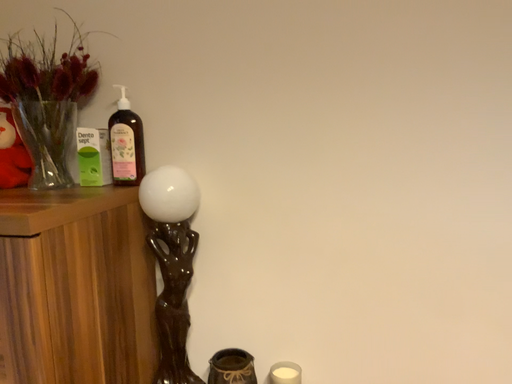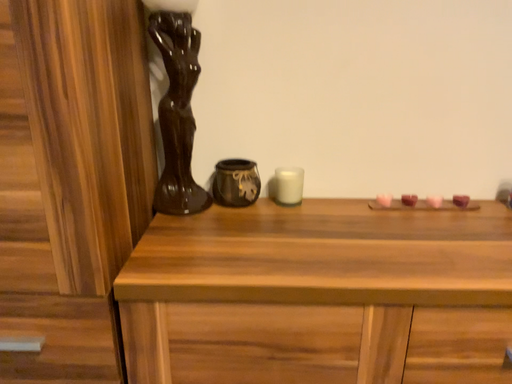
Question: Which way did the camera rotate in the video?

Choices:
 (A) rotated left
 (B) rotated right

Answer: (B)